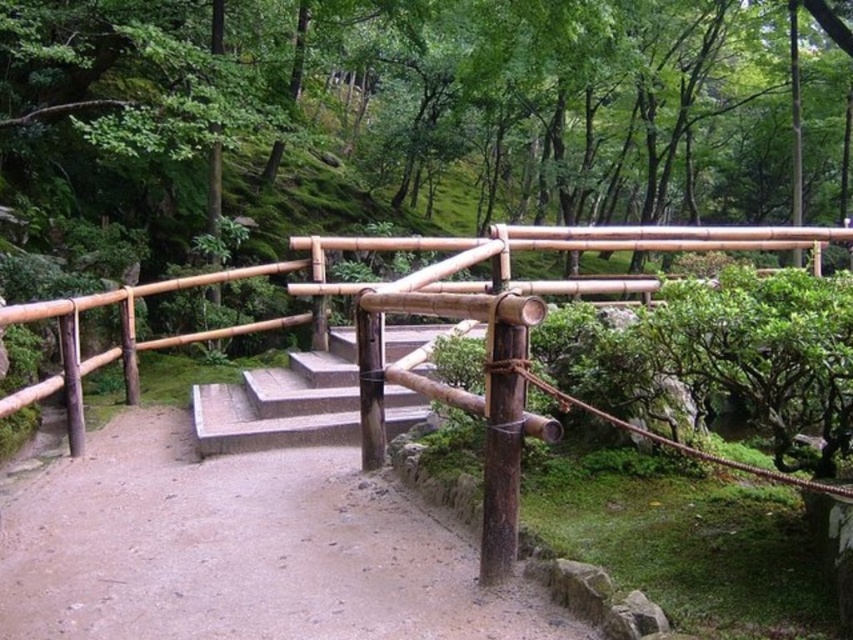
Who is more forward, (759, 236) or (397, 352)?

Point (397, 352)

The image size is (853, 640). Identify the location of natural bamboo railing at center. coord(409,310).

Who is lower down, brown gravel path at center or smooth concrete stairs at center?

brown gravel path at center is below.

Does point (265, 609) come farther from viewer compared to point (323, 440)?

That is False.

Find the location of `brown gravel path at center`. brown gravel path at center is located at coordinates pos(241,548).

Does brown gravel path at center appear over natural bamboo railing at center?

Incorrect, brown gravel path at center is not positioned above natural bamboo railing at center.

Is brown gravel path at center in front of natural bamboo railing at center?

Yes, brown gravel path at center is closer to the viewer.

Which is in front, point (190, 595) or point (360, 419)?

Point (190, 595) is more forward.

The width and height of the screenshot is (853, 640). Find the location of `brown gravel path at center`. brown gravel path at center is located at coordinates (241, 548).